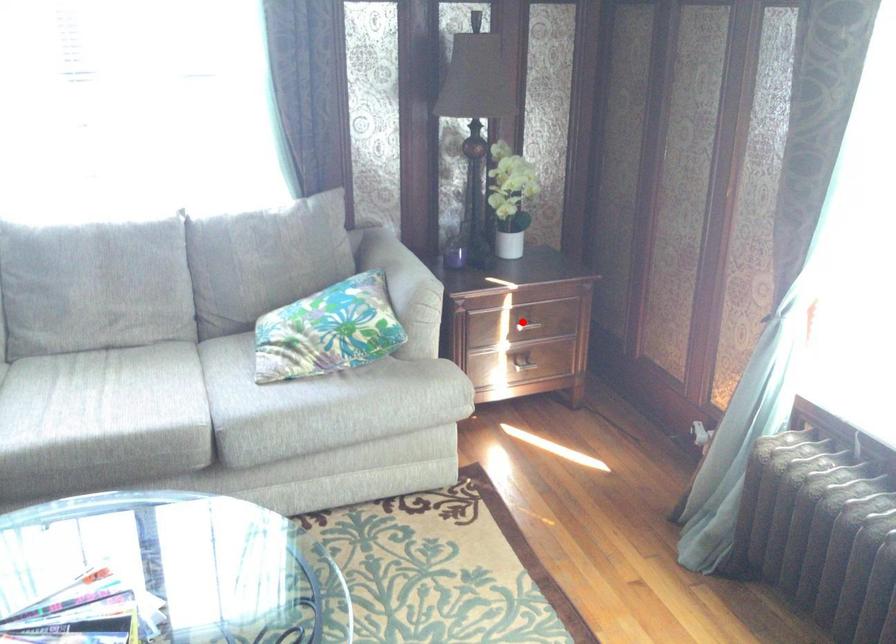
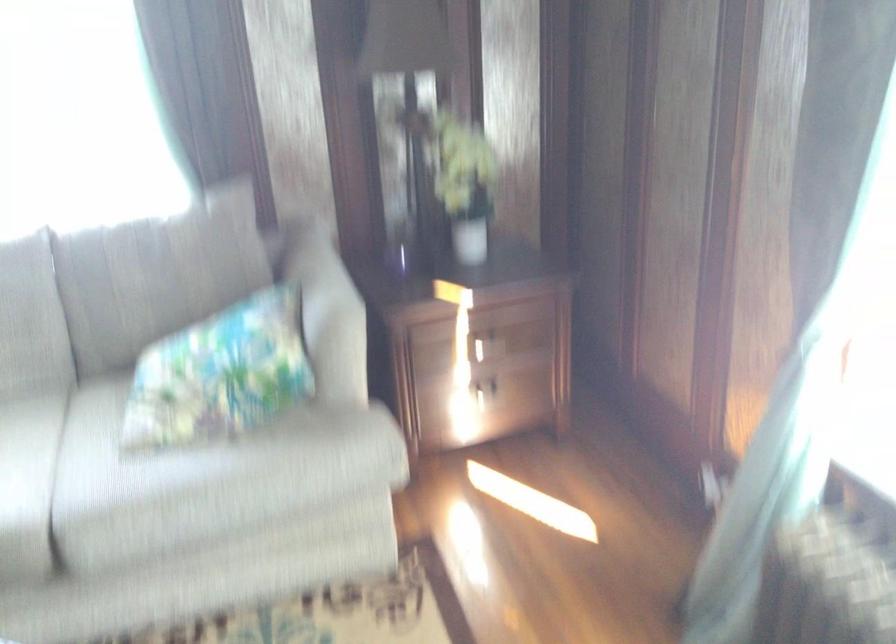
The point at the highlighted location is marked in the first image. Where is the corresponding point in the second image?

(487, 345)